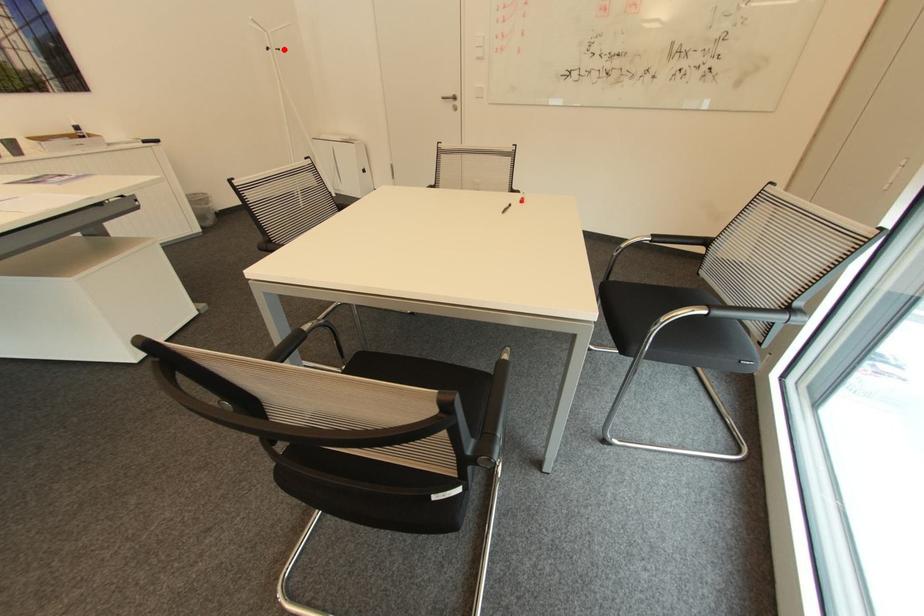
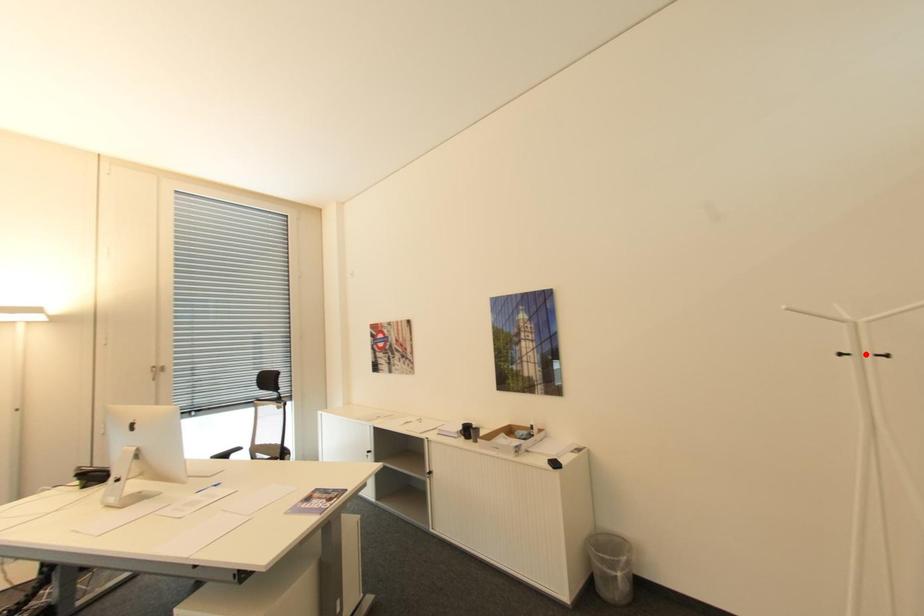
Consider the image. I am providing you with two images of the same scene from different viewpoints. A red point is marked on the first image and another point is marked on the second image. Is the marked point in image1 the same physical position as the marked point in image2?

No